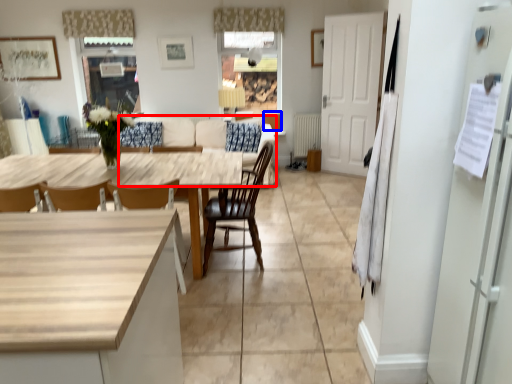
Question: Among these objects, which one is nearest to the camera, couch (highlighted by a red box) or cabinetry (highlighted by a blue box)?

Choices:
 (A) couch
 (B) cabinetry

Answer: (A)